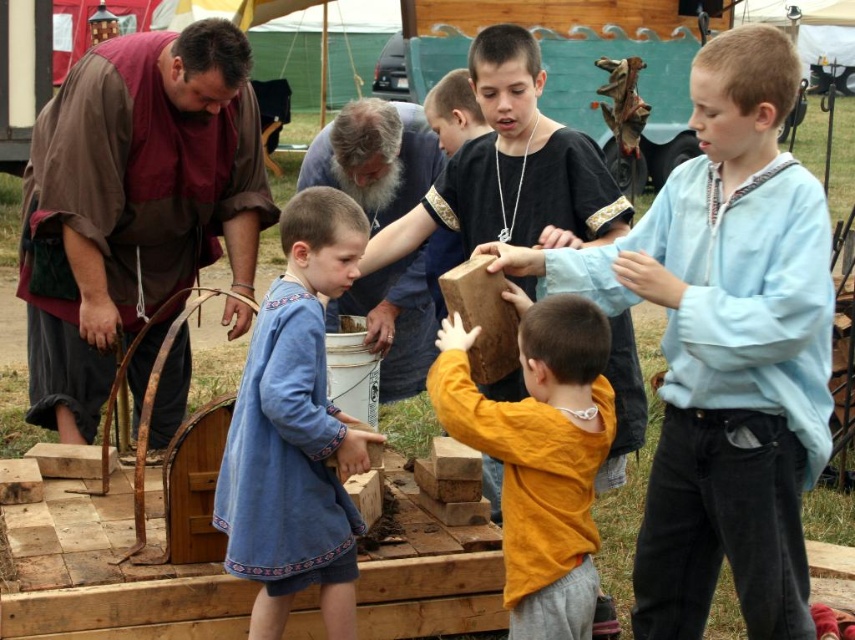
You are standing in the middle of the scene and want to pick up an object. Which point, point (785, 422) or point (376, 340), would be easier to reach?

Point (785, 422) is closer to the camera than point (376, 340), so it would be easier to reach.

You are a photographer at the event and need to capture a photo of both the light blue cotton shirt at center and the brown leather vest at left. Based on their positions, which one should you focus on first to ensure both are in frame?

The light blue cotton shirt at center is below the brown leather vest at left, so you should focus on the brown leather vest at left first to ensure both are in frame.